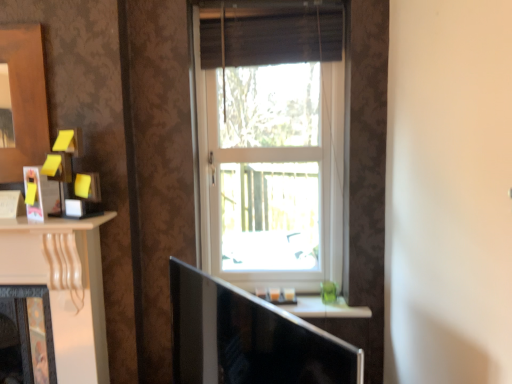
Question: From the image's perspective, is matte black tv at center on white glossy window sill at center?

Choices:
 (A) no
 (B) yes

Answer: (A)

Question: Can you confirm if matte black tv at center is positioned to the left of white glossy window sill at center?

Choices:
 (A) yes
 (B) no

Answer: (A)

Question: Does matte black tv at center have a larger size compared to white glossy window sill at center?

Choices:
 (A) no
 (B) yes

Answer: (B)

Question: Can you confirm if matte black tv at center is taller than white glossy window sill at center?

Choices:
 (A) no
 (B) yes

Answer: (B)

Question: From a real-world perspective, does matte black tv at center sit lower than white glossy window sill at center?

Choices:
 (A) yes
 (B) no

Answer: (B)

Question: From a real-world perspective, relative to white plastic window at center, is brown fabric curtain at upper center vertically above or below?

Choices:
 (A) below
 (B) above

Answer: (B)

Question: Considering the positions of brown fabric curtain at upper center and white plastic window at center in the image, is brown fabric curtain at upper center wider or thinner than white plastic window at center?

Choices:
 (A) wide
 (B) thin

Answer: (A)

Question: Considering their positions, is brown fabric curtain at upper center located in front of or behind white plastic window at center?

Choices:
 (A) front
 (B) behind

Answer: (A)

Question: From the image's perspective, is brown fabric curtain at upper center positioned above or below white plastic window at center?

Choices:
 (A) above
 (B) below

Answer: (A)

Question: Is matte black picture frame at left spatially inside matte black fireplace at left, or outside of it?

Choices:
 (A) inside
 (B) outside

Answer: (B)

Question: Is matte black picture frame at left in front of or behind matte black fireplace at left in the image?

Choices:
 (A) front
 (B) behind

Answer: (A)

Question: Is point (30, 168) closer or farther from the camera than point (26, 317)?

Choices:
 (A) closer
 (B) farther

Answer: (A)

Question: In the image, is matte black picture frame at left on the left side or the right side of matte black fireplace at left?

Choices:
 (A) left
 (B) right

Answer: (B)

Question: Considering the relative positions of white plastic window at center and white glossy window sill at center in the image provided, is white plastic window at center to the left or to the right of white glossy window sill at center?

Choices:
 (A) right
 (B) left

Answer: (B)

Question: Based on their sizes in the image, would you say white plastic window at center is bigger or smaller than white glossy window sill at center?

Choices:
 (A) small
 (B) big

Answer: (B)